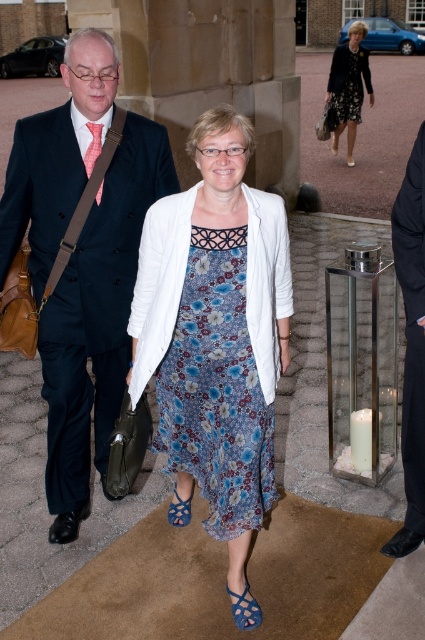
What is the object located at the coordinates point (x=215, y=332) in the image?

The point (x=215, y=332) corresponds to the floral fabric dress at center.

You are a photographer adjusting your camera settings. You need to focus on the black fabric business suit at right and the blue woven sandal at center. Which object should you adjust your focus to first if you want to capture both in sharp detail?

The black fabric business suit at right has a greater height compared to the blue woven sandal at center, so you should focus on the black fabric business suit at right first because it is taller and will require adjusting the focus to a greater distance.